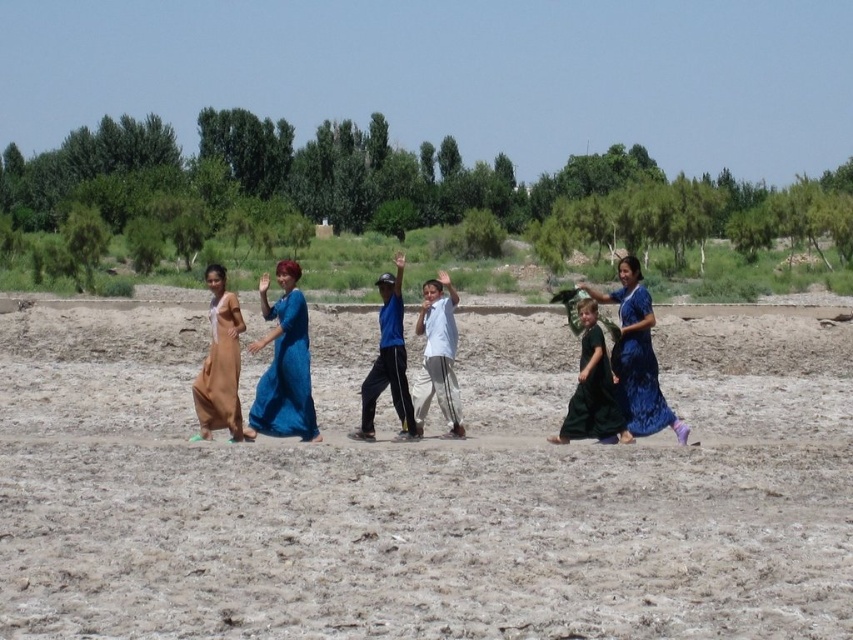
You are a drone operator trying to capture a photo of the group of six individuals walking on the brown sandy ground at center. The drone is currently at point A, which is located at coordinates 0.7, 0.4. To ensure the group is centered in the photo, should you move the drone north or south? Please explain your reasoning.

The brown sandy ground at center is located at point [416,497]. Since the drone is at [340,448], which is to the southwest of the target point, you should move the drone northeast to center the group in the photo.

Based on the scene description, which object is shorter between the blue satin dress at right and the dark green dress at center?

The blue satin dress at right is shorter than the dark green dress at center.

You are a photographer positioned at the center of the image. You want to capture a photo of the blue satin dress at right. According to the coordinates provided, in which direction should you move your camera to frame the dress properly?

The blue satin dress at right is located at coordinates 0.573 on the x axis and 0.748 on the y axis. Since the photographer is at the center, they should move the camera slightly to the right and upwards to align with the dress.